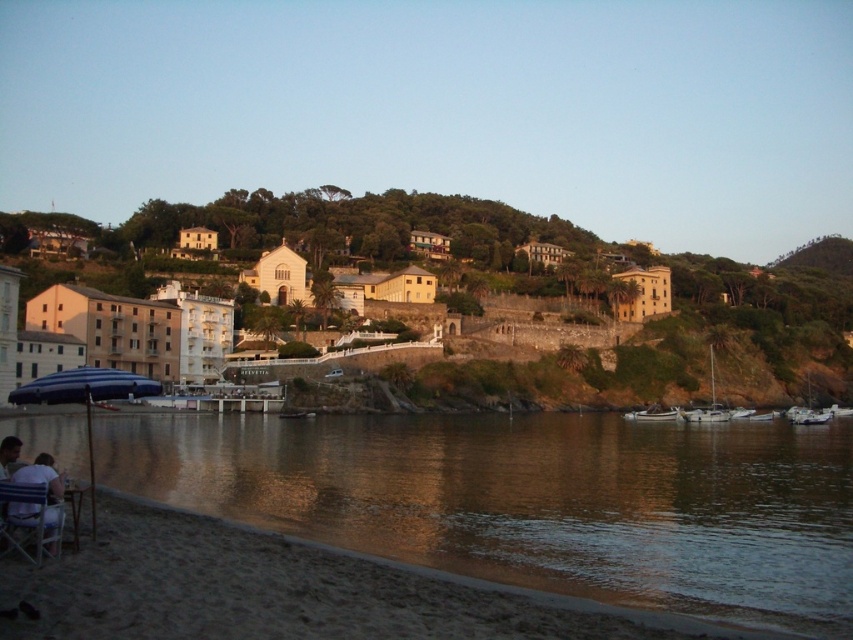
Can you confirm if metallic silver beach chair at lower left is positioned to the right of white glossy sailboat at lower right?

No, metallic silver beach chair at lower left is not to the right of white glossy sailboat at lower right.

Could you measure the distance between metallic silver beach chair at lower left and white glossy sailboat at lower right?

They are 88.23 meters apart.

Find the location of a particular element. The height and width of the screenshot is (640, 853). metallic silver beach chair at lower left is located at coordinates (28, 518).

Does point (537, 529) come behind point (9, 499)?

Yes, point (537, 529) is farther from viewer.

Does brown reflective water at lower left have a lesser height compared to metallic silver beach chair at lower left?

Incorrect, brown reflective water at lower left's height does not fall short of metallic silver beach chair at lower left's.

Is point (781, 609) farther from camera compared to point (42, 525)?

Yes, it is behind point (42, 525).

Where is `brown reflective water at lower left`? The height and width of the screenshot is (640, 853). brown reflective water at lower left is located at coordinates (534, 499).

Between yellow stucco buildings at center and blue matte umbrella at lower left, which one has less height?

blue matte umbrella at lower left

This screenshot has width=853, height=640. What do you see at coordinates (473, 262) in the screenshot?
I see `yellow stucco buildings at center` at bounding box center [473, 262].

Is point (682, 276) positioned behind point (100, 400)?

Yes, it is behind point (100, 400).

You are a GUI agent. You are given a task and a screenshot of the screen. Output one action in this format:
    pyautogui.click(x=<x>, y=<y>)
    Task: Click on the yellow stucco buildings at center
    
    Given the screenshot: What is the action you would take?
    pyautogui.click(x=473, y=262)